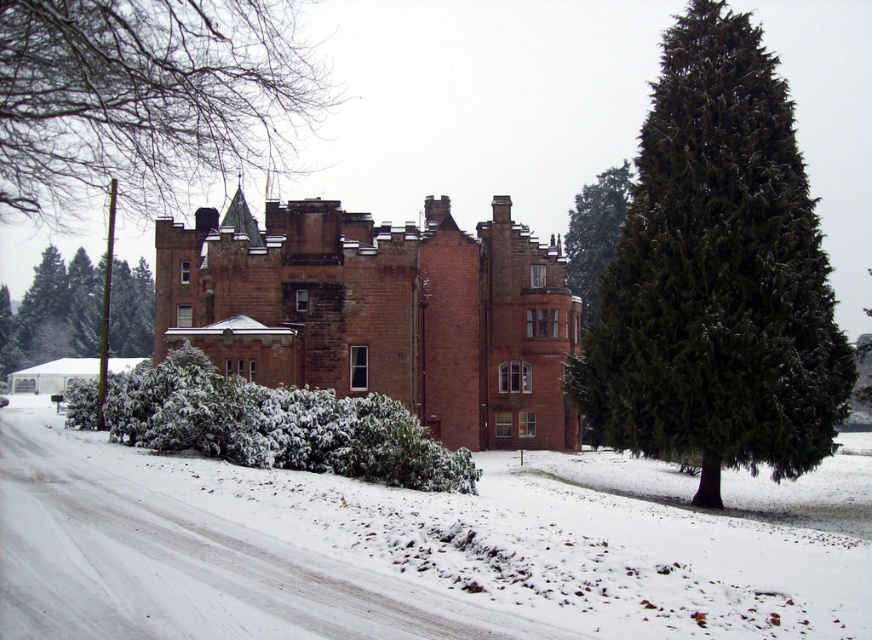
Which is more to the right, white fluffy snow at center or green textured tree at upper center?

Positioned to the right is white fluffy snow at center.

Does white fluffy snow at center have a larger size compared to green textured tree at upper center?

No.

Which is in front, point (70, 481) or point (249, 26)?

Positioned in front is point (70, 481).

Where is `white fluffy snow at center`? The width and height of the screenshot is (872, 640). white fluffy snow at center is located at coordinates (383, 556).

Where is `white fluffy snow at center`? white fluffy snow at center is located at coordinates (383, 556).

Which is behind, point (850, 636) or point (394, 444)?

The point (394, 444) is behind.

You are a GUI agent. You are given a task and a screenshot of the screen. Output one action in this format:
    pyautogui.click(x=<x>, y=<y>)
    Task: Click on the white fluffy snow at center
    The height and width of the screenshot is (640, 872).
    Given the screenshot: What is the action you would take?
    pyautogui.click(x=383, y=556)

Is green textured tree at upper center taller than green textured evergreen tree at right?

Indeed, green textured tree at upper center has a greater height compared to green textured evergreen tree at right.

Between green textured tree at upper center and green textured evergreen tree at right, which one appears on the left side from the viewer's perspective?

green textured tree at upper center

Does point (125, 186) come farther from viewer compared to point (576, 225)?

No, (125, 186) is closer to viewer.

The image size is (872, 640). I want to click on green textured tree at upper center, so click(145, 99).